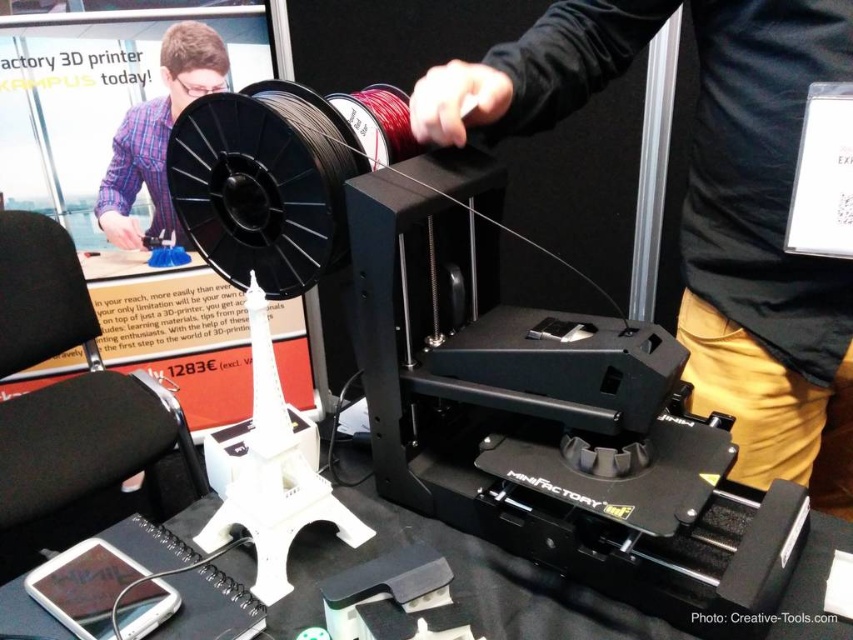
You are standing in front of the MINIFACTORY 3D printer at the exhibition. There are two points marked in the image. One is at coordinates point [709,216] and the other at point [248,531]. Which point is closer to you?

Point [709,216] is further to the viewer than point [248,531], so the point closer to you is point [248,531].

You are a trade show attendee who wants to take a photo of the white plastic eiffel tower at lower center. Since the black matte 3d printer at center is blocking the view, can you move the tower to the side to get a clear shot?

The black matte 3d printer at center is larger than the white plastic eiffel tower at lower center, so moving the tower might be possible but requires checking if there is enough space around the printer.

You are standing at the origin point of the coordinate system in the image. The black matte 3d printer at center is located at point (764, 248). What is the coordinate of the black matte 3d printer at center?

The black matte 3d printer at center is located at point (764, 248).